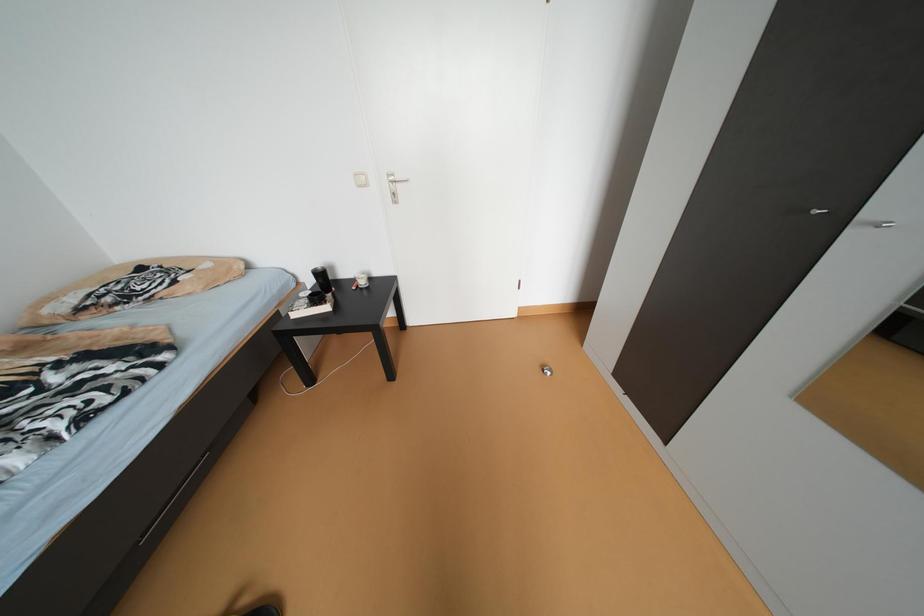
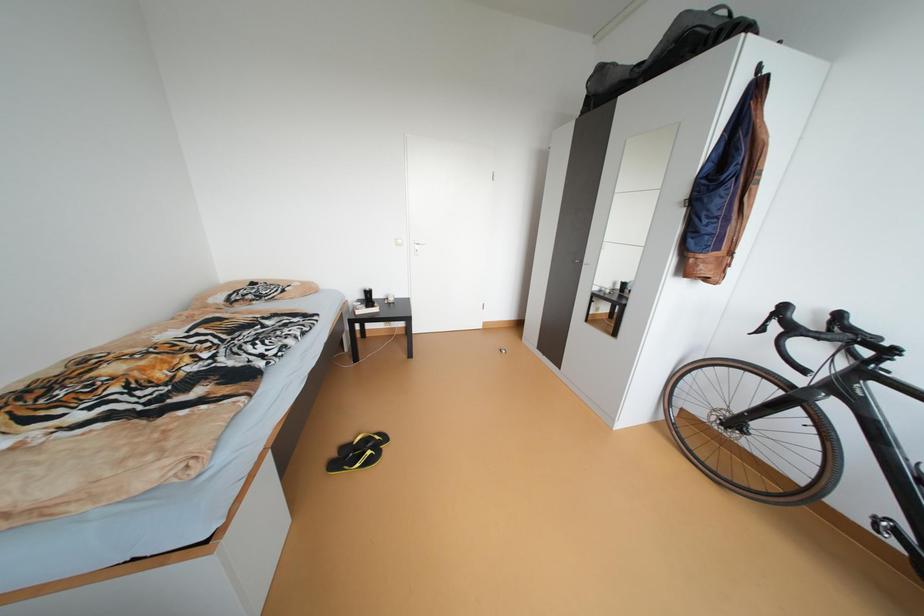
Which direction would the cameraman need to move to produce the second image?

The movement direction of the cameraman is left, backward.